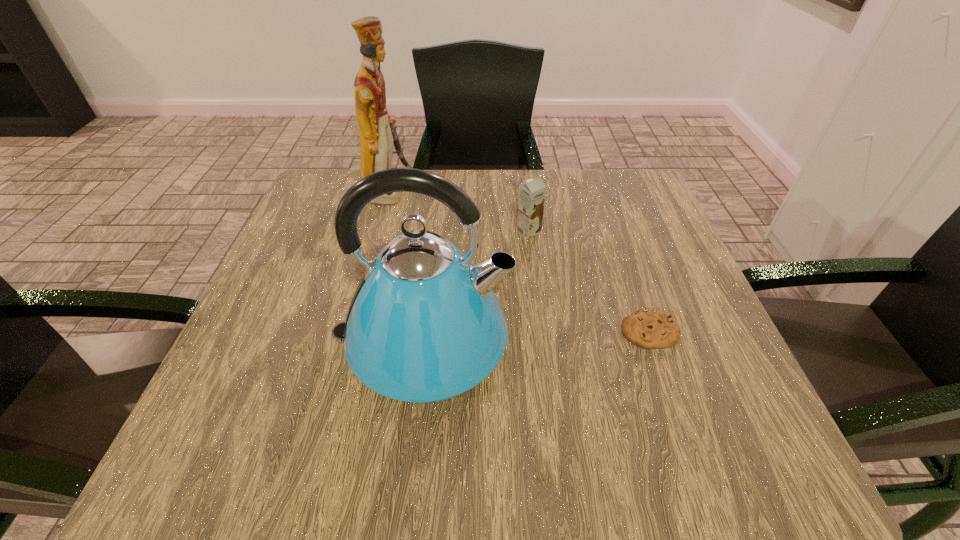
Find the location of a particular element. vacant space at the far right corner of the desktop is located at coordinates (645, 190).

This screenshot has height=540, width=960. Find the location of `free location at the near right corner`. free location at the near right corner is located at coordinates (758, 441).

In order to click on vacant area that lies between the second tallest object and the rightmost object in this screenshot , I will do `click(536, 338)`.

At what (x,y) coordinates should I click in order to perform the action: click on vacant area that lies between the chocolate milk and the cookie. Please return your answer as a coordinate pair (x, y). Looking at the image, I should click on (588, 281).

You are a GUI agent. You are given a task and a screenshot of the screen. Output one action in this format:
    pyautogui.click(x=<x>, y=<y>)
    Task: Click on the free space between the cookie and the third shortest object
    
    Given the screenshot: What is the action you would take?
    pyautogui.click(x=536, y=338)

Image resolution: width=960 pixels, height=540 pixels. Find the location of `vacant area that lies between the second shortest object and the shortest object`. vacant area that lies between the second shortest object and the shortest object is located at coordinates (588, 281).

Where is `free space between the nutcracker and the cookie`? The height and width of the screenshot is (540, 960). free space between the nutcracker and the cookie is located at coordinates (518, 261).

Select which object appears as the second closest to the shortest object. Please provide its 2D coordinates. Your answer should be formatted as a tuple, i.e. [(x, y)], where the tuple contains the x and y coordinates of a point satisfying the conditions above.

[(531, 198)]

Locate which object ranks second in proximity to the third shortest object. Please provide its 2D coordinates. Your answer should be formatted as a tuple, i.e. [(x, y)], where the tuple contains the x and y coordinates of a point satisfying the conditions above.

[(650, 328)]

Identify the location of vacant region that satisfies the following two spatial constraints: 1. on the front-facing side of the farthest object; 2. on the right side of the shortest object. (351, 331).